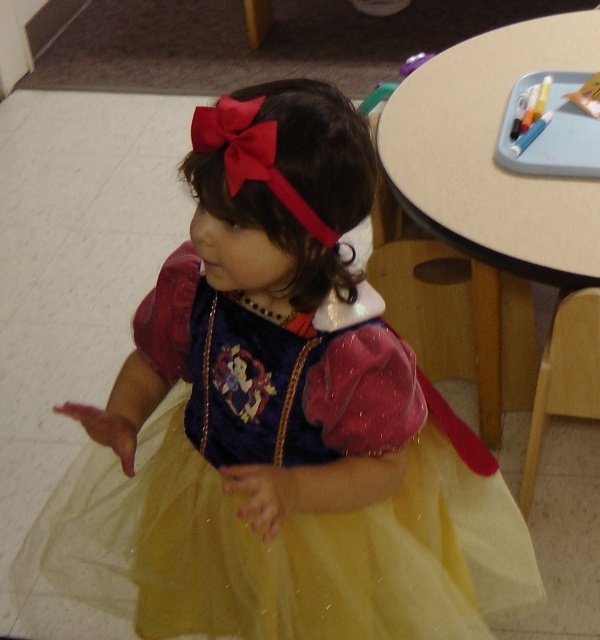
You are a parent helping your child get ready for a school play. The child is wearing the yellow tulle dress at center and needs to sit at the beige laminate table at upper right to finish their costume. Based on the image, can the child sit comfortably at the table without the dress getting in the way?

The yellow tulle dress at center might be wider than beige laminate table at upper right, so there is a possibility that the dress could get caught or in the way when sitting down. It is advisable to check the space carefully before seating the child.

You are a photographer setting up for a photo shoot. You need to position a light source so that it illuminates the yellow tulle dress at center without casting a shadow on the beige laminate table at upper right. Based on their positions, is this possible?

The yellow tulle dress at center is closer to the viewer than the beige laminate table at upper right. Therefore, positioning the light source above and slightly behind the dress could illuminate it while the table, being further away, would not have a shadow cast upon it.

You are a photographer setting up for a photoshoot. You need to position the yellow tulle dress at center and the beige laminate table at upper right in such a way that the dress is to the left of the table. Is the current arrangement in the image suitable for your requirement?

Yes, the current arrangement is suitable because the yellow tulle dress at center is already positioned to the left of the beige laminate table at upper right as described in the Objects Description.